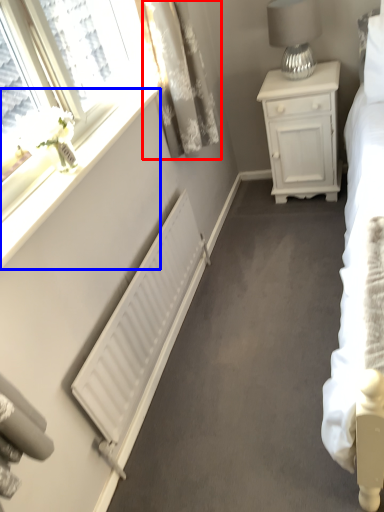
Question: Which of the following is the closest to the observer, curtain (highlighted by a red box) or window sill (highlighted by a blue box)?

Choices:
 (A) curtain
 (B) window sill

Answer: (B)